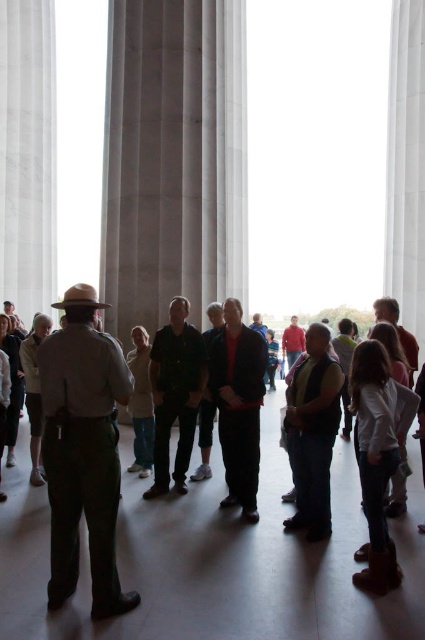
Question: Observing the image, what is the correct spatial positioning of white marble pillar at upper center in reference to black uniform at center?

Choices:
 (A) right
 (B) left

Answer: (A)

Question: Is white marble pillar at upper center bigger than red fabric jacket at center?

Choices:
 (A) no
 (B) yes

Answer: (B)

Question: Among these objects, which one is nearest to the camera?

Choices:
 (A) red fabric jacket at center
 (B) black uniform at center

Answer: (A)

Question: Which object appears closest to the camera in this image?

Choices:
 (A) black uniform at center
 (B) white marble pillar at center

Answer: (A)

Question: Which point is farther to the camera?

Choices:
 (A) khaki uniform at center
 (B) black uniform at center

Answer: (B)

Question: Observing the image, what is the correct spatial positioning of white marble pillar at center in reference to white marble pillar at upper center?

Choices:
 (A) right
 (B) left

Answer: (B)